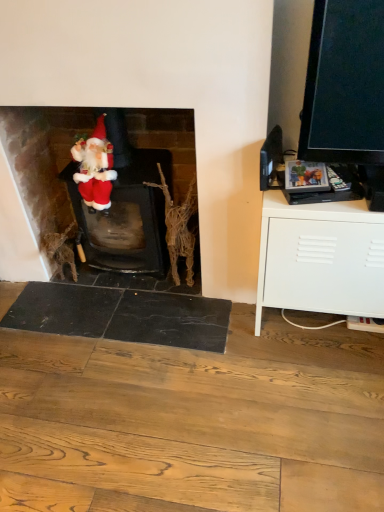
Question: Can you confirm if white matte cabinet at right is shorter than bark-like textured branch at center?

Choices:
 (A) yes
 (B) no

Answer: (B)

Question: Is white matte cabinet at right closer to camera compared to bark-like textured branch at center?

Choices:
 (A) yes
 (B) no

Answer: (A)

Question: Is the surface of white matte cabinet at right in direct contact with bark-like textured branch at center?

Choices:
 (A) yes
 (B) no

Answer: (B)

Question: Is white matte cabinet at right thinner than bark-like textured branch at center?

Choices:
 (A) yes
 (B) no

Answer: (B)

Question: Is white matte cabinet at right wider than bark-like textured branch at center?

Choices:
 (A) yes
 (B) no

Answer: (A)

Question: From the image's perspective, is white matte cabinet at right below bark-like textured branch at center?

Choices:
 (A) no
 (B) yes

Answer: (B)

Question: From the image's perspective, is white matte cabinet at right under matte red santa at left?

Choices:
 (A) yes
 (B) no

Answer: (A)

Question: Does white matte cabinet at right turn towards matte red santa at left?

Choices:
 (A) no
 (B) yes

Answer: (A)

Question: Is matte red santa at left a part of white matte cabinet at right?

Choices:
 (A) no
 (B) yes

Answer: (A)

Question: Considering the relative positions of white matte cabinet at right and matte red santa at left in the image provided, is white matte cabinet at right to the left of matte red santa at left from the viewer's perspective?

Choices:
 (A) yes
 (B) no

Answer: (B)

Question: Is white matte cabinet at right positioned with its back to matte red santa at left?

Choices:
 (A) no
 (B) yes

Answer: (A)

Question: Is white matte cabinet at right bigger than matte red santa at left?

Choices:
 (A) yes
 (B) no

Answer: (A)

Question: From the image's perspective, is velvet red santa at center under white matte cabinet at right?

Choices:
 (A) no
 (B) yes

Answer: (A)